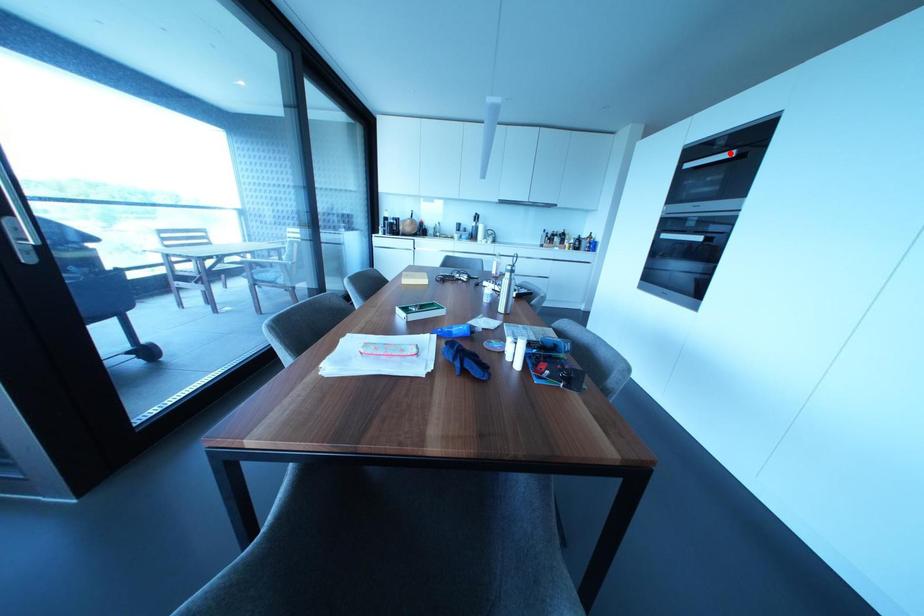
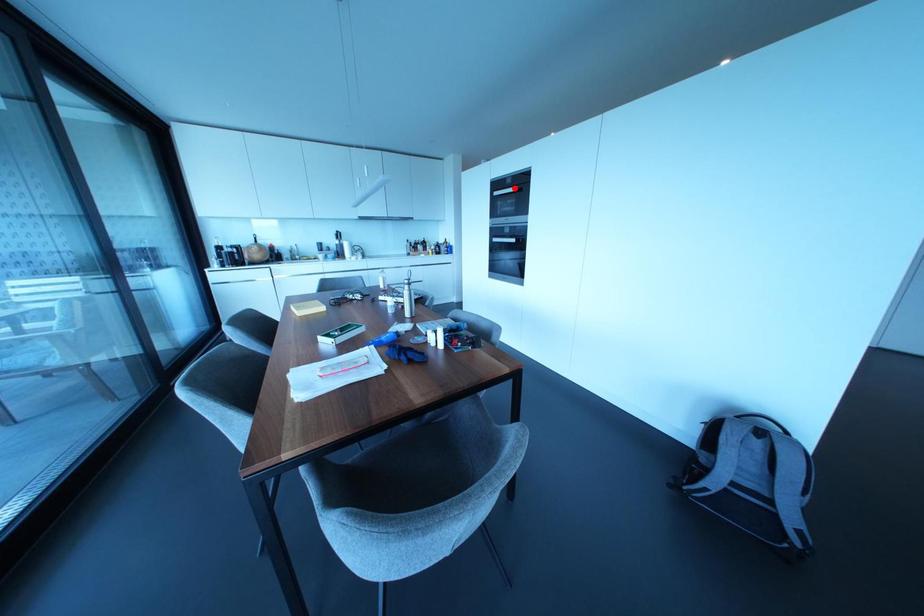
I am providing you with two images of the same scene from different viewpoints. A red point is marked on the first image and another point is marked on the second image. Does the point marked in image1 correspond to the same location as the one in image2?

Yes